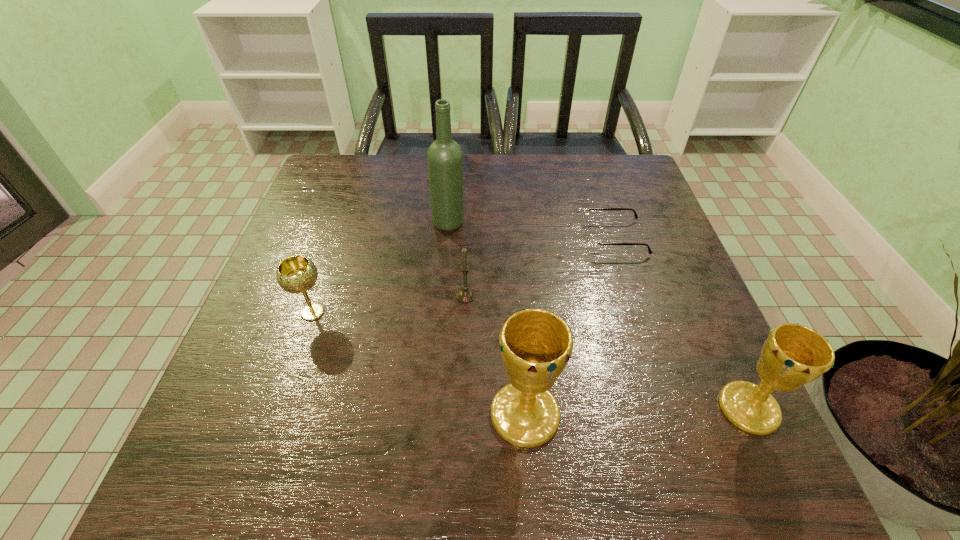
Find the location of a particular element. Image resolution: width=960 pixels, height=540 pixels. spectacles located at the right edge is located at coordinates (595, 240).

You are a GUI agent. You are given a task and a screenshot of the screen. Output one action in this format:
    pyautogui.click(x=<x>, y=<y>)
    Task: Click on the object present at the near right corner
    
    Given the screenshot: What is the action you would take?
    pyautogui.click(x=793, y=355)

Where is `vacant space at the far edge of the desktop`? This screenshot has width=960, height=540. vacant space at the far edge of the desktop is located at coordinates click(x=396, y=165).

Where is `free space at the left edge of the desktop`? The width and height of the screenshot is (960, 540). free space at the left edge of the desktop is located at coordinates (328, 236).

In order to click on blank space at the right edge of the desktop in this screenshot , I will do `click(649, 289)`.

Locate an element on the screen. Image resolution: width=960 pixels, height=540 pixels. vacant space at the far right corner is located at coordinates (645, 186).

Locate an element on the screen. free region at the near right corner of the desktop is located at coordinates (648, 384).

Find the location of `vacant area between the tallest object and the leftmost object`. vacant area between the tallest object and the leftmost object is located at coordinates (381, 268).

Find the location of a particular element. The width and height of the screenshot is (960, 540). vacant area that lies between the second object from right to left and the tallest chalice is located at coordinates (570, 326).

I want to click on vacant point located between the fourth object from left to right and the third tallest object, so click(636, 411).